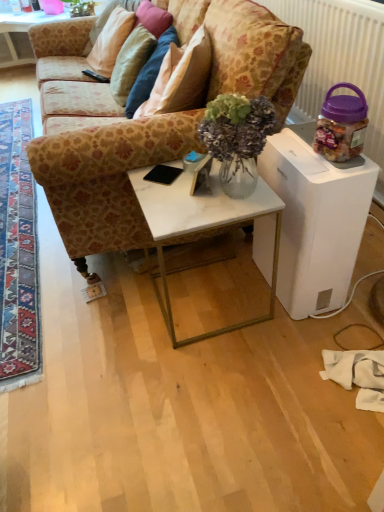
Question: From a real-world perspective, is white glossy humidifier at right, which is the second table from bottom to top, physically above black plastic remote control at upper left?

Choices:
 (A) no
 (B) yes

Answer: (A)

Question: Can you confirm if white glossy humidifier at right, which is the 3th table from back to front, is positioned to the right of black plastic remote control at upper left?

Choices:
 (A) yes
 (B) no

Answer: (A)

Question: Is white glossy humidifier at right, which is the 3th table from back to front, not close to black plastic remote control at upper left?

Choices:
 (A) yes
 (B) no

Answer: (A)

Question: Considering the relative positions of white glossy humidifier at right, which ranks as the second table in top-to-bottom order, and black plastic remote control at upper left in the image provided, is white glossy humidifier at right, which ranks as the second table in top-to-bottom order, behind black plastic remote control at upper left?

Choices:
 (A) yes
 (B) no

Answer: (B)

Question: From the image's perspective, is white glossy humidifier at right, which ranks as the 1th table in right-to-left order, located above black plastic remote control at upper left?

Choices:
 (A) yes
 (B) no

Answer: (B)

Question: Visually, is beige fabric pillow at upper left, which is the first pillow from left to right, positioned to the left or to the right of carpeted rug at lower left?

Choices:
 (A) right
 (B) left

Answer: (A)

Question: From their relative heights in the image, would you say beige fabric pillow at upper left, which is the first pillow from left to right, is taller or shorter than carpeted rug at lower left?

Choices:
 (A) short
 (B) tall

Answer: (B)

Question: In the image, is beige fabric pillow at upper left, which is the first pillow from left to right, positioned in front of or behind carpeted rug at lower left?

Choices:
 (A) behind
 (B) front

Answer: (A)

Question: From a real-world perspective, is beige fabric pillow at upper left, the second pillow from the right, above or below carpeted rug at lower left?

Choices:
 (A) above
 (B) below

Answer: (A)

Question: From a real-world perspective, is black matte mobile phone at center positioned above or below white marble table at center, positioned as the 3th table in bottom-to-top order?

Choices:
 (A) below
 (B) above

Answer: (B)

Question: Is black matte mobile phone at center inside the boundaries of white marble table at center, the third table viewed from the front, or outside?

Choices:
 (A) inside
 (B) outside

Answer: (B)

Question: Looking at the image, does black matte mobile phone at center seem bigger or smaller compared to white marble table at center, positioned as the 3th table in bottom-to-top order?

Choices:
 (A) small
 (B) big

Answer: (A)

Question: Does point (170, 169) appear closer or farther from the camera than point (1, 57)?

Choices:
 (A) farther
 (B) closer

Answer: (B)

Question: Looking at the image, does white marble table at center, which appears as the first table when viewed from the top, seem bigger or smaller compared to patterned fabric couch at center?

Choices:
 (A) small
 (B) big

Answer: (A)

Question: From a real-world perspective, is white marble table at center, positioned as the 3th table in bottom-to-top order, above or below patterned fabric couch at center?

Choices:
 (A) above
 (B) below

Answer: (B)